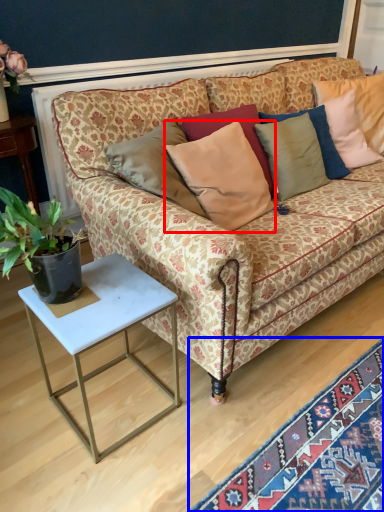
Question: Which point is closer to the camera, pillow (highlighted by a red box) or mat (highlighted by a blue box)?

Choices:
 (A) pillow
 (B) mat

Answer: (B)